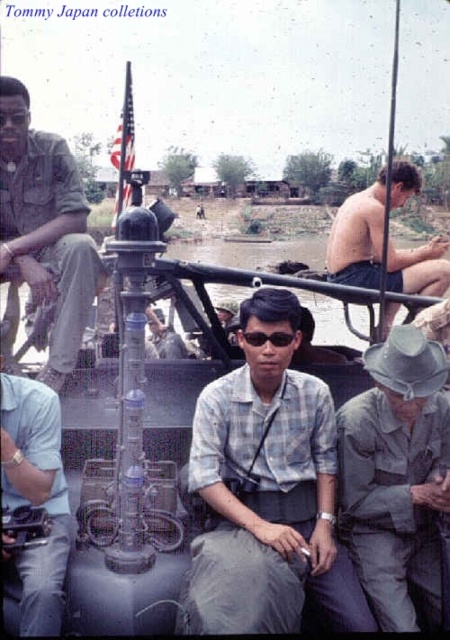
You are a photographer taking a picture of the scene. You notice the plaid shirt at center and the brushed metal helmet at upper left. Which object is shorter in height?

The plaid shirt at center has a lesser height compared to the brushed metal helmet at upper left, so the plaid shirt at center is shorter in height.

Based on the photo, what is located at the point with coordinates [268,490] in the image?

The plaid shirt at center is located at point [268,490].

You are a photographer trying to capture a clear shot of the plaid shirt at center and the brushed metal helmet at upper left. Which object is closer to the camera?

The plaid shirt at center is closer to the camera because it is in front of the brushed metal helmet at upper left.